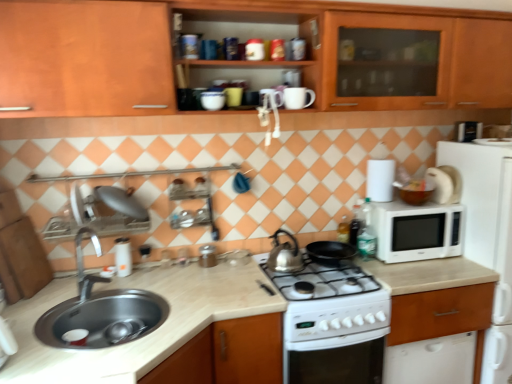
Locate an element on the screen. This screenshot has height=384, width=512. free space to the back side of satin silver kettle at center is located at coordinates (284, 248).